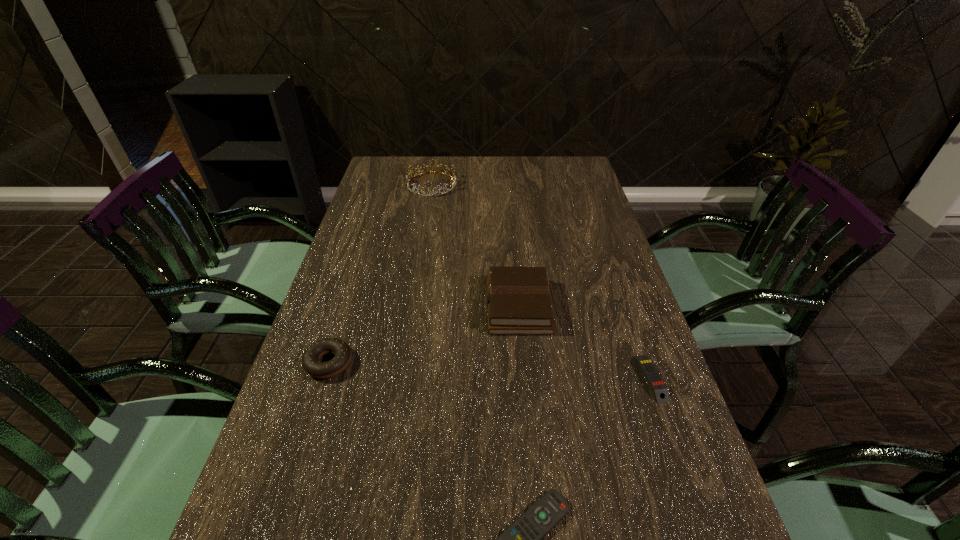
In the image, there is a desktop. At what (x,y) coordinates should I click in order to perform the action: click on vacant space at the right edge. Please return your answer as a coordinate pair (x, y). Image resolution: width=960 pixels, height=540 pixels. Looking at the image, I should click on (686, 480).

In the image, there is a desktop. At what (x,y) coordinates should I click in order to perform the action: click on blank space at the far left corner. Please return your answer as a coordinate pair (x, y). Looking at the image, I should click on (395, 163).

I want to click on free space between the doughnut and the fourth object from right to left, so click(x=380, y=273).

You are a GUI agent. You are given a task and a screenshot of the screen. Output one action in this format:
    pyautogui.click(x=<x>, y=<y>)
    Task: Click on the vacant region between the doughnut and the tiara
    The height and width of the screenshot is (540, 960).
    Given the screenshot: What is the action you would take?
    pyautogui.click(x=380, y=273)

The width and height of the screenshot is (960, 540). Find the location of `vacant region between the doughnut and the Bible`. vacant region between the doughnut and the Bible is located at coordinates (423, 334).

At what (x,y) coordinates should I click in order to perform the action: click on vacant space that's between the leftmost object and the fourth nearest object. Please return your answer as a coordinate pair (x, y). Image resolution: width=960 pixels, height=540 pixels. Looking at the image, I should click on 423,334.

Find the location of `unoccupied position between the third tallest object and the rightmost object`. unoccupied position between the third tallest object and the rightmost object is located at coordinates (490, 370).

Locate which object ranks in proximity to the shortest object. Please provide its 2D coordinates. Your answer should be formatted as a tuple, i.e. [(x, y)], where the tuple contains the x and y coordinates of a point satisfying the conditions above.

[(657, 385)]

Find the location of a particular element. The image size is (960, 540). object identified as the closest to the nearest object is located at coordinates [657, 385].

Find the location of a particular element. This screenshot has height=540, width=960. vacant space that satisfies the following two spatial constraints: 1. on the front side of the taller remote control; 2. on the left side of the doughnut is located at coordinates (324, 378).